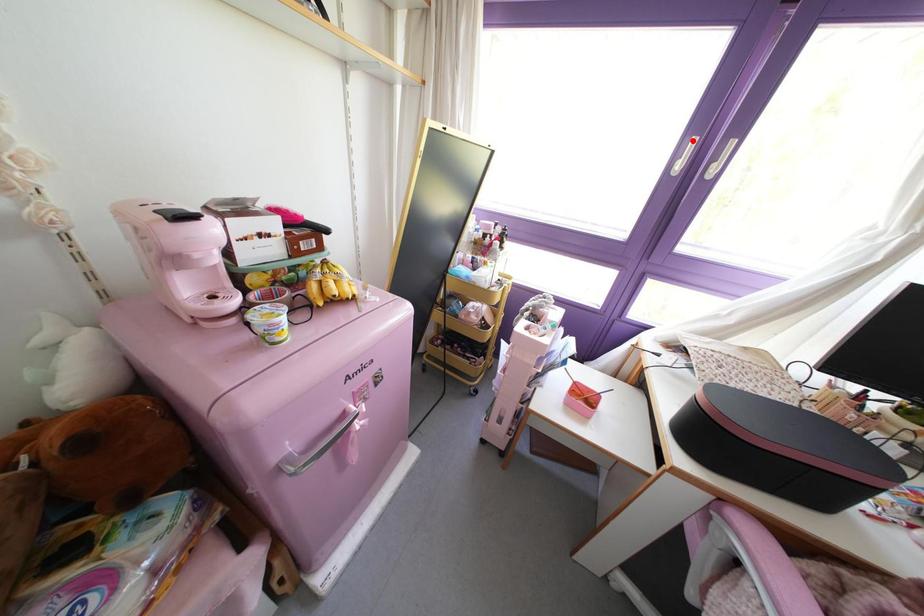
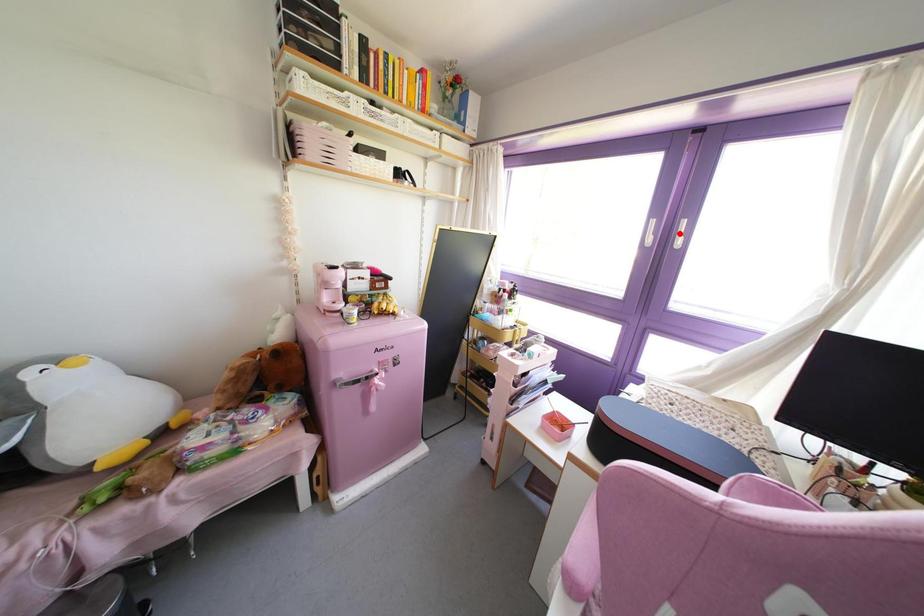
I am providing you with two images of the same scene from different viewpoints. A red point is marked on the first image and another point is marked on the second image. Does the point marked in image1 correspond to the same location as the one in image2?

No